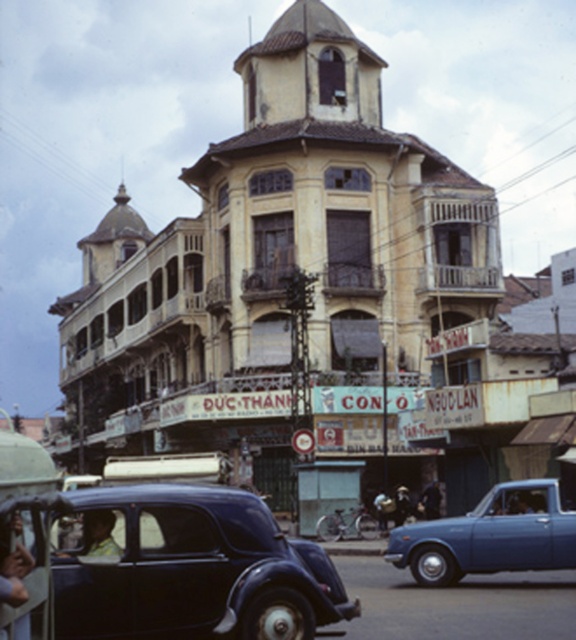
Question: Is metallic blue sedan at center positioned behind light brown leather jacket at lower left?

Choices:
 (A) no
 (B) yes

Answer: (B)

Question: Which object is closer to the camera taking this photo?

Choices:
 (A) metallic blue sedan at center
 (B) light brown leather jacket at lower left

Answer: (B)

Question: Which point is farther from the camera taking this photo?

Choices:
 (A) (1, 593)
 (B) (429, 504)
 (C) (472, 556)

Answer: (B)

Question: Can you confirm if shiny black car at center-left is smaller than dark blue fabric jacket at center?

Choices:
 (A) no
 (B) yes

Answer: (A)

Question: Does metallic blue sedan at center appear under light brown leather jacket at lower left?

Choices:
 (A) yes
 (B) no

Answer: (A)

Question: Which of the following is the farthest from the observer?

Choices:
 (A) (427, 492)
 (B) (18, 582)
 (C) (225, 492)

Answer: (A)